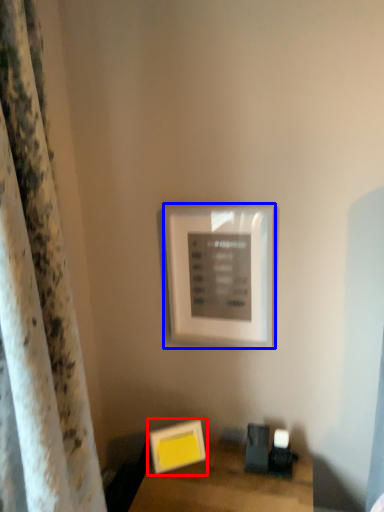
Question: Which point is closer to the camera, picture frame (highlighted by a red box) or picture frame (highlighted by a blue box)?

Choices:
 (A) picture frame
 (B) picture frame

Answer: (B)